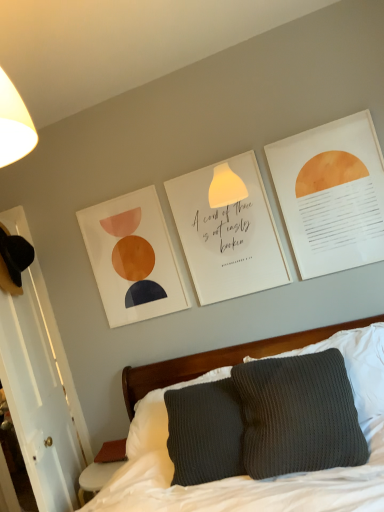
Question: Is knitted gray pillow at center to the left of matte paper picture frame at upper center from the viewer's perspective?

Choices:
 (A) no
 (B) yes

Answer: (A)

Question: Is knitted gray pillow at center shorter than matte paper picture frame at upper center?

Choices:
 (A) no
 (B) yes

Answer: (B)

Question: Is knitted gray pillow at center touching matte paper picture frame at upper center?

Choices:
 (A) no
 (B) yes

Answer: (A)

Question: From a real-world perspective, does knitted gray pillow at center stand above matte paper picture frame at upper center?

Choices:
 (A) yes
 (B) no

Answer: (B)

Question: Does knitted gray pillow at center have a smaller size compared to matte paper picture frame at upper center?

Choices:
 (A) yes
 (B) no

Answer: (B)

Question: Relative to matte paper picture frame at upper center, is knitted gray pillow at center in front or behind?

Choices:
 (A) behind
 (B) front

Answer: (B)

Question: In terms of width, does knitted gray pillow at center look wider or thinner when compared to matte paper picture frame at upper center?

Choices:
 (A) thin
 (B) wide

Answer: (B)

Question: Would you say knitted gray pillow at center is inside or outside matte paper picture frame at upper center?

Choices:
 (A) inside
 (B) outside

Answer: (B)

Question: Would you say knitted gray pillow at center is to the left or to the right of matte paper picture frame at upper center in the picture?

Choices:
 (A) right
 (B) left

Answer: (A)

Question: From the image's perspective, is dark gray knitted pillow at center positioned above or below matte orange circle at upper right, the 1th postcard from the right?

Choices:
 (A) above
 (B) below

Answer: (B)

Question: Considering the positions of dark gray knitted pillow at center and matte orange circle at upper right, the 1th postcard from the right, in the image, is dark gray knitted pillow at center bigger or smaller than matte orange circle at upper right, the 1th postcard from the right,?

Choices:
 (A) small
 (B) big

Answer: (B)

Question: From a real-world perspective, relative to matte orange circle at upper right, the first postcard viewed from the front, is dark gray knitted pillow at center vertically above or below?

Choices:
 (A) above
 (B) below

Answer: (B)

Question: Is point (322, 382) positioned closer to the camera than point (324, 254)?

Choices:
 (A) closer
 (B) farther

Answer: (A)

Question: Which is correct: dark gray knitted pillow at center is inside knitted gray pillow at center, or outside of it?

Choices:
 (A) inside
 (B) outside

Answer: (A)

Question: Does point (241, 374) appear closer or farther from the camera than point (163, 422)?

Choices:
 (A) farther
 (B) closer

Answer: (B)